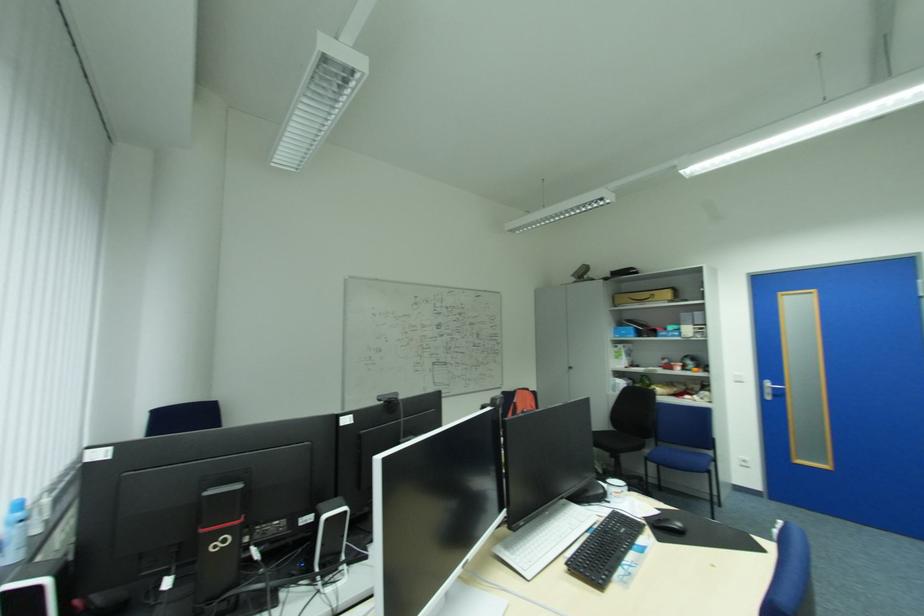
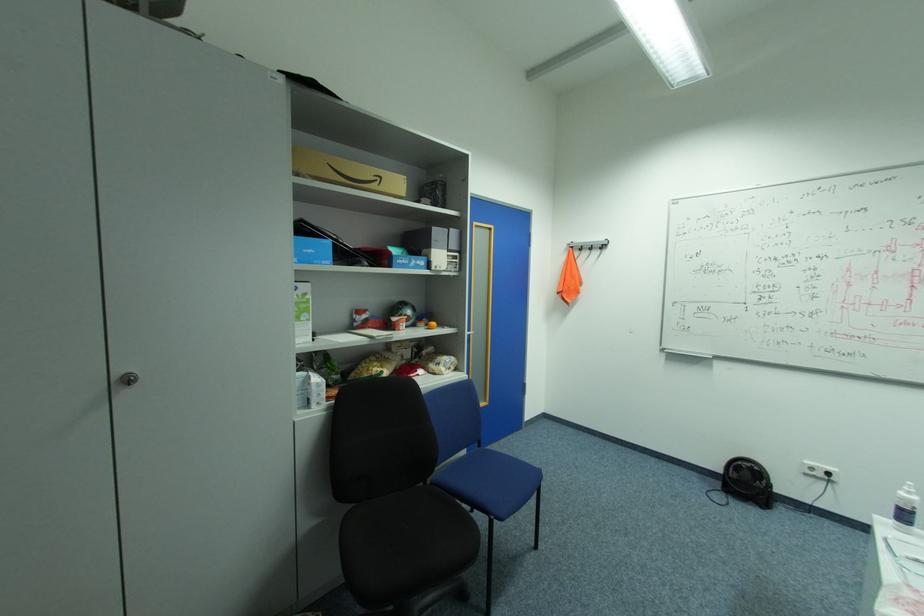
Locate, in the second image, the point that corresponds to (636,336) in the first image.

(331, 262)